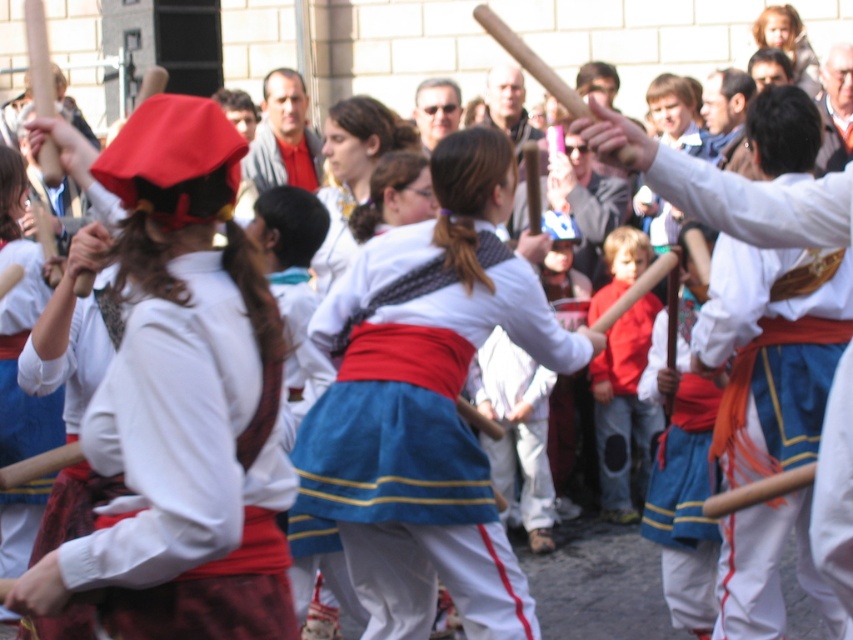
Is matte white blouse at center to the right of red cotton shirt at center from the viewer's perspective?

Incorrect, matte white blouse at center is not on the right side of red cotton shirt at center.

Is matte white blouse at center behind red cotton shirt at center?

No, matte white blouse at center is in front of red cotton shirt at center.

At what (x,y) coordinates should I click in order to perform the action: click on matte white blouse at center. Please return your answer as a coordinate pair (x, y). Looking at the image, I should click on [186, 472].

Does blue cotton skirt at center have a greater width compared to blue satin sash at center?

Yes, blue cotton skirt at center is wider than blue satin sash at center.

What do you see at coordinates (425, 452) in the screenshot? This screenshot has width=853, height=640. I see `blue cotton skirt at center` at bounding box center [425, 452].

Locate an element on the screen. blue cotton skirt at center is located at coordinates (425, 452).

The height and width of the screenshot is (640, 853). In order to click on blue cotton skirt at center in this screenshot , I will do `click(425, 452)`.

Between blue cotton skirt at center and red cotton shirt at center, which one has less height?

blue cotton skirt at center is shorter.

The width and height of the screenshot is (853, 640). What do you see at coordinates (425, 452) in the screenshot?
I see `blue cotton skirt at center` at bounding box center [425, 452].

Locate an element on the screen. blue cotton skirt at center is located at coordinates (425, 452).